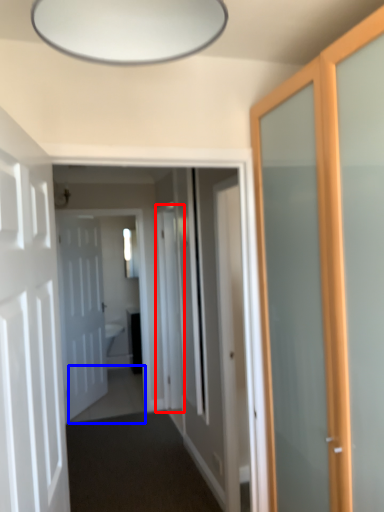
Question: Which object is further to the camera taking this photo, screen door (highlighted by a red box) or path (highlighted by a blue box)?

Choices:
 (A) screen door
 (B) path

Answer: (B)